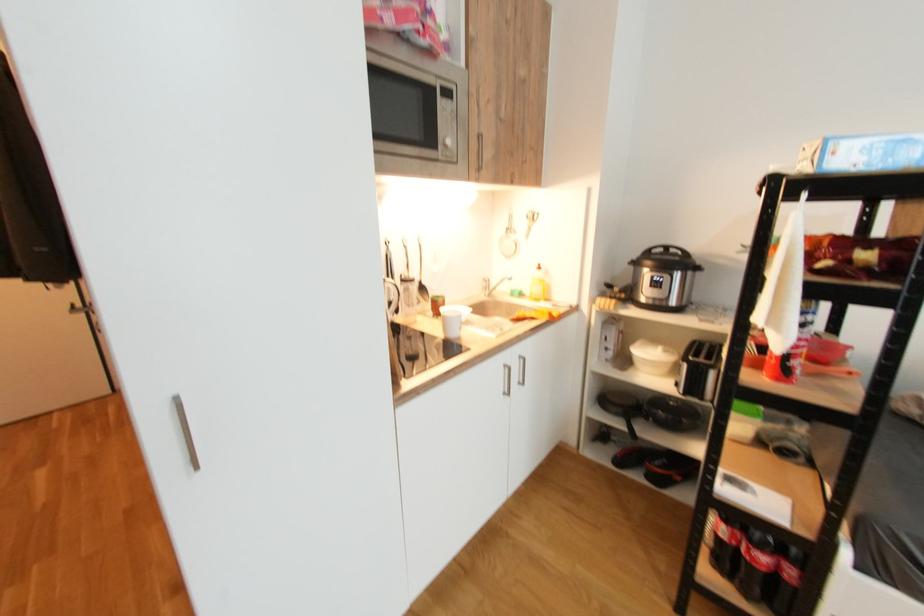
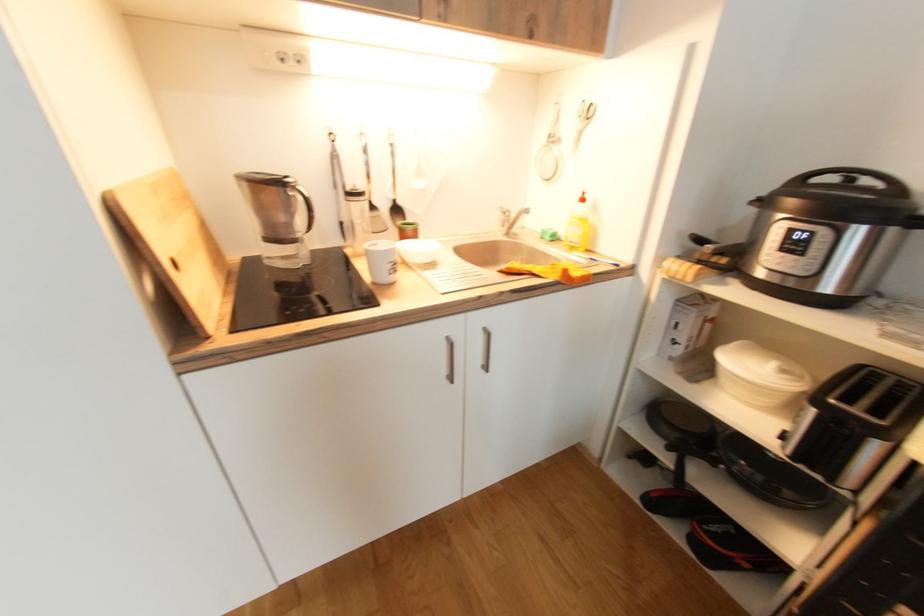
The images are taken continuously from a first-person perspective. In which direction are you moving?

The cameraman moved toward right, forward.